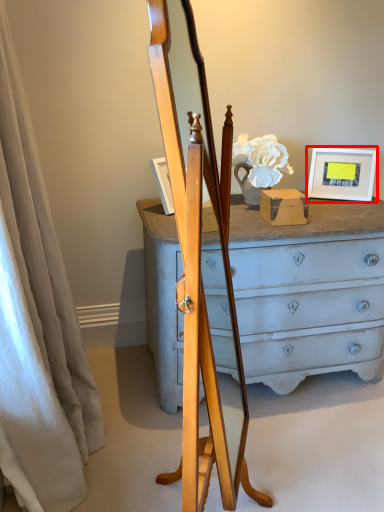
Question: Observing the image, what is the correct spatial positioning of picture frame (annotated by the red box) in reference to curtain?

Choices:
 (A) right
 (B) left

Answer: (A)